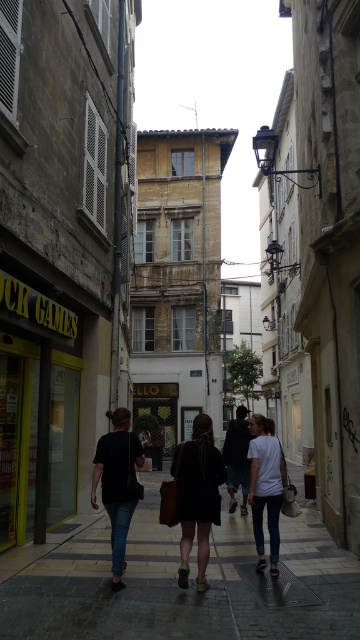
You are a tourist walking on the dark gray stone pavement at center and want to pick up the dark brown leather jacket at center. Is the jacket within your reach?

The dark gray stone pavement at center is located below dark brown leather jacket at center, so yes, the jacket is within your reach as it is above the pavement.

You are a tailor trying to decide which garment to alter first. You have a dark brown leather jacket at center and a black matte shirt at center. Which garment has a smaller width?

The dark brown leather jacket at center has a smaller width than the black matte shirt at center according to the description.